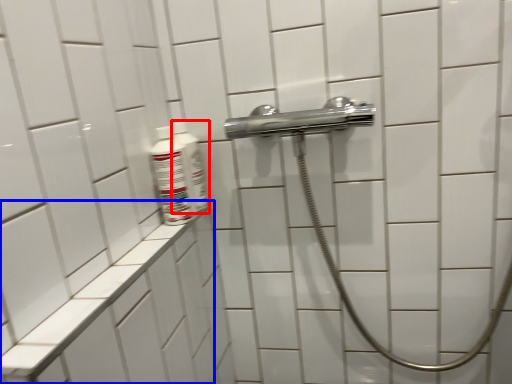
Question: Among these objects, which one is farthest to the camera, mouthwash (highlighted by a red box) or ledge (highlighted by a blue box)?

Choices:
 (A) mouthwash
 (B) ledge

Answer: (A)